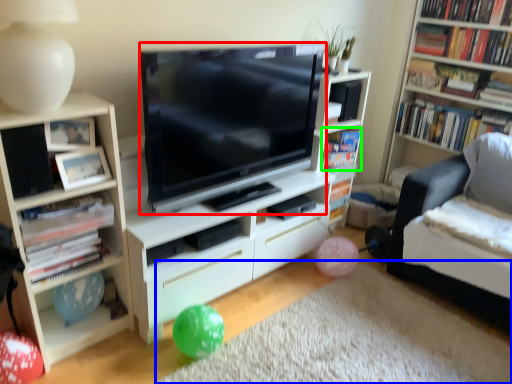
Question: Considering the real-world distances, which object is farthest from television (highlighted by a red box)? plain (highlighted by a blue box) or book (highlighted by a green box)?

Choices:
 (A) plain
 (B) book

Answer: (A)